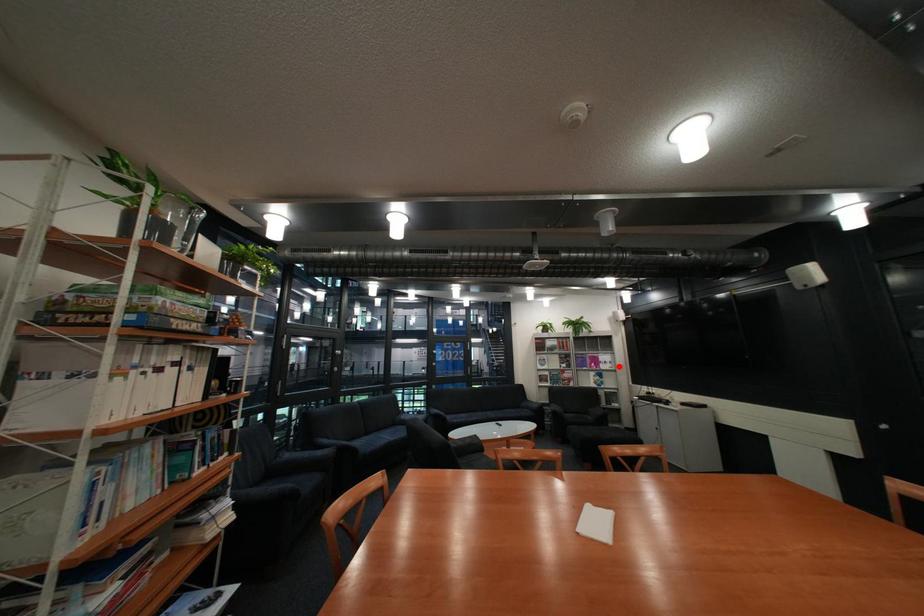
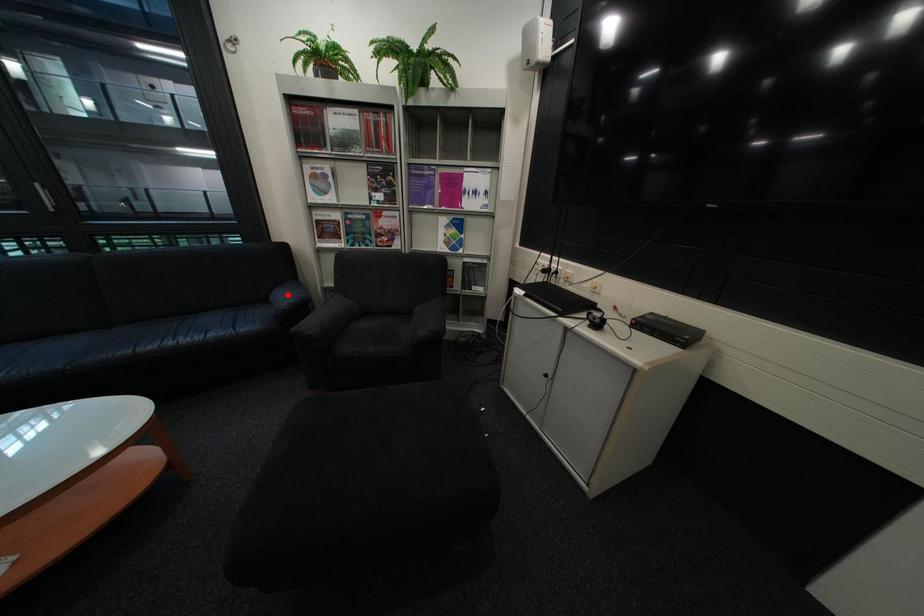
I am providing you with two images of the same scene from different viewpoints. A red point is marked on the first image and another point is marked on the second image. Is the red point in image1 aligned with the point shown in image2?

No